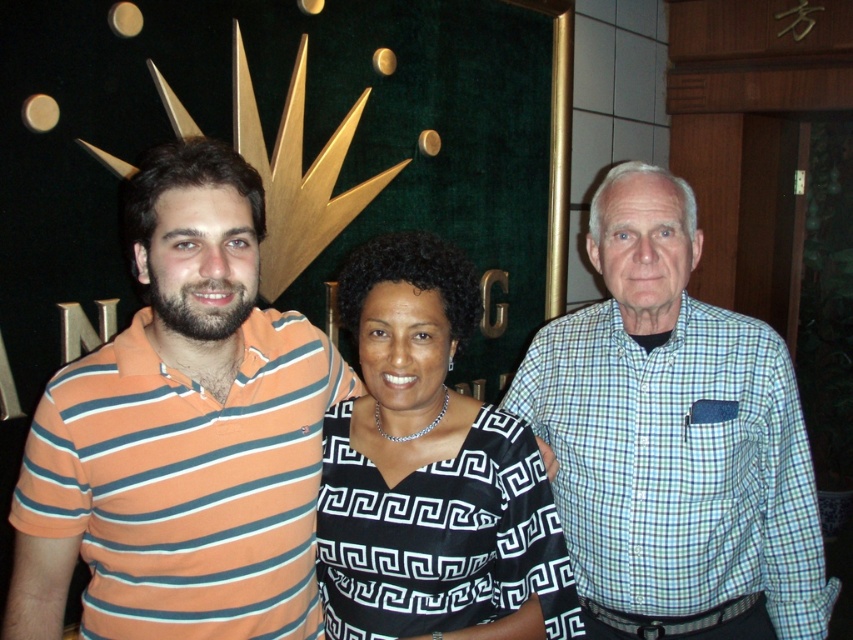
Based on the scene description, which person is wearing a shorter shirt, the one in the orange striped polo shirt at left or the light blue checkered shirt at center?

The orange striped polo shirt at left is shorter than the light blue checkered shirt at center.

You are a photographer standing 1.2 meters away from the orange striped polo shirt at left. Can you adjust your position to ensure you are exactly 1.14 meters away from it?

Yes, you can move closer to the orange striped polo shirt at left by 0.06 meters to be exactly 1.14 meters away from it.